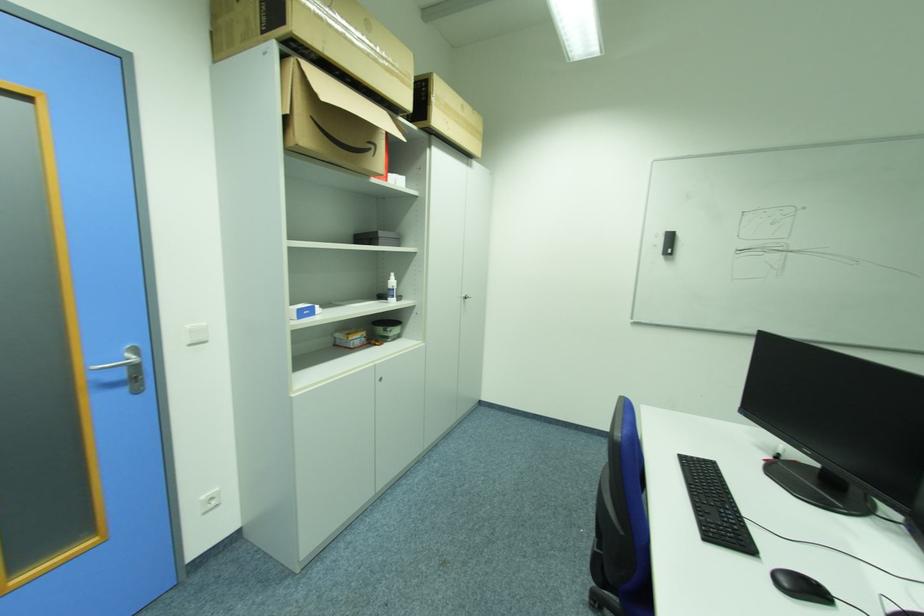
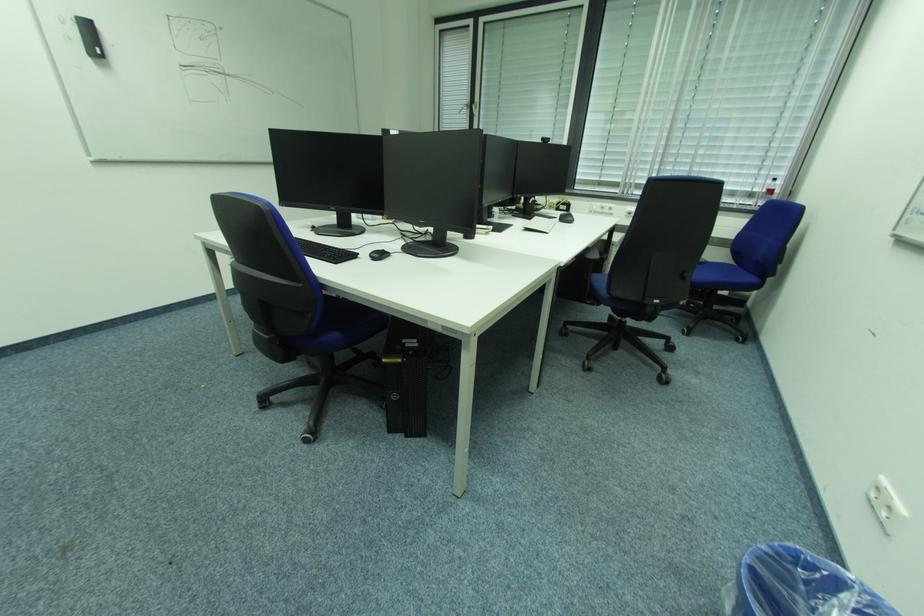
First-person continuous shooting, in which direction is the camera rotating?

The rotation direction of the camera is right-down.